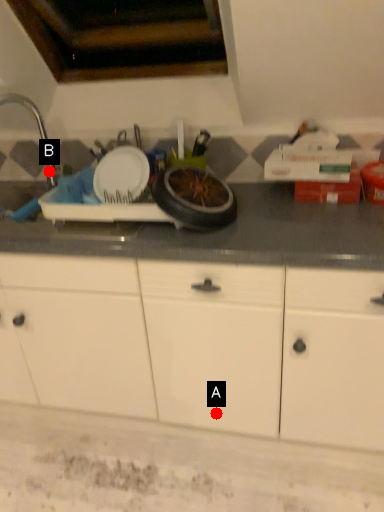
Question: Two points are circled on the image, labeled by A and B beside each circle. Which point appears closest to the camera in this image?

Choices:
 (A) A is closer
 (B) B is closer

Answer: (A)